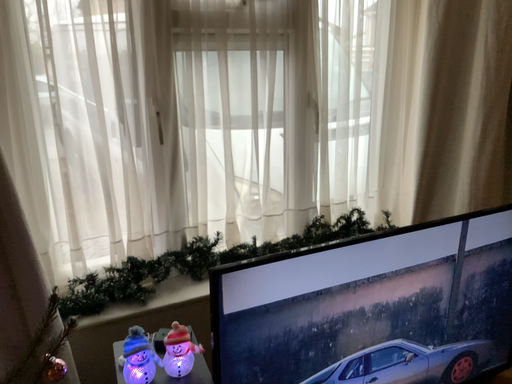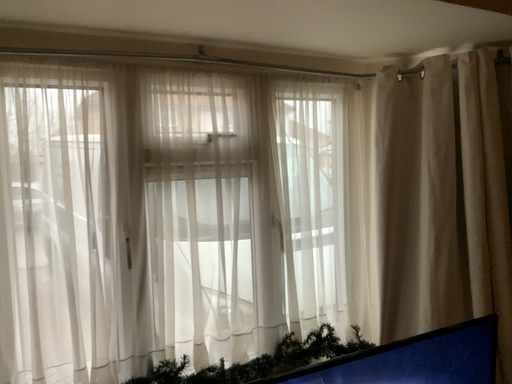
Question: How did the camera likely rotate when shooting the video?

Choices:
 (A) rotated upward
 (B) rotated downward

Answer: (A)